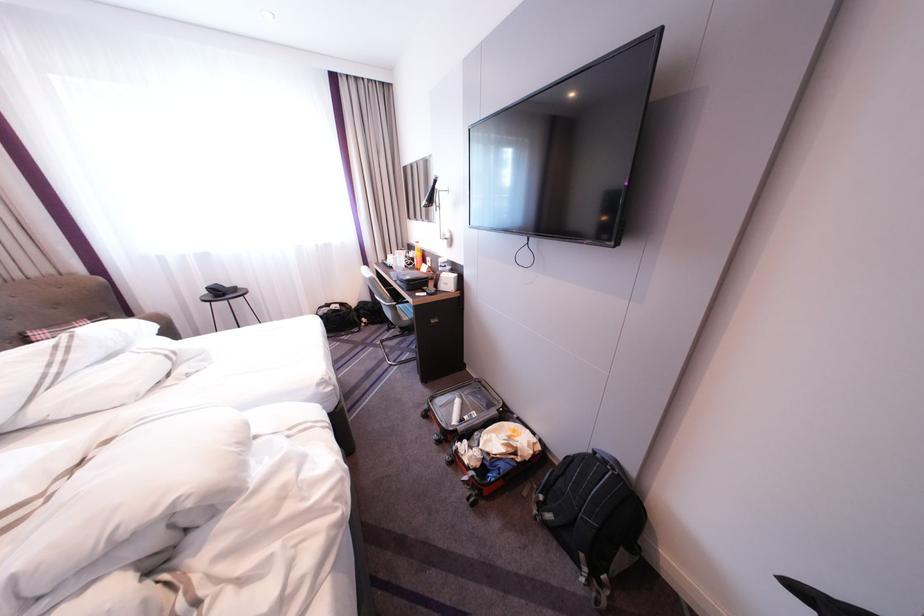
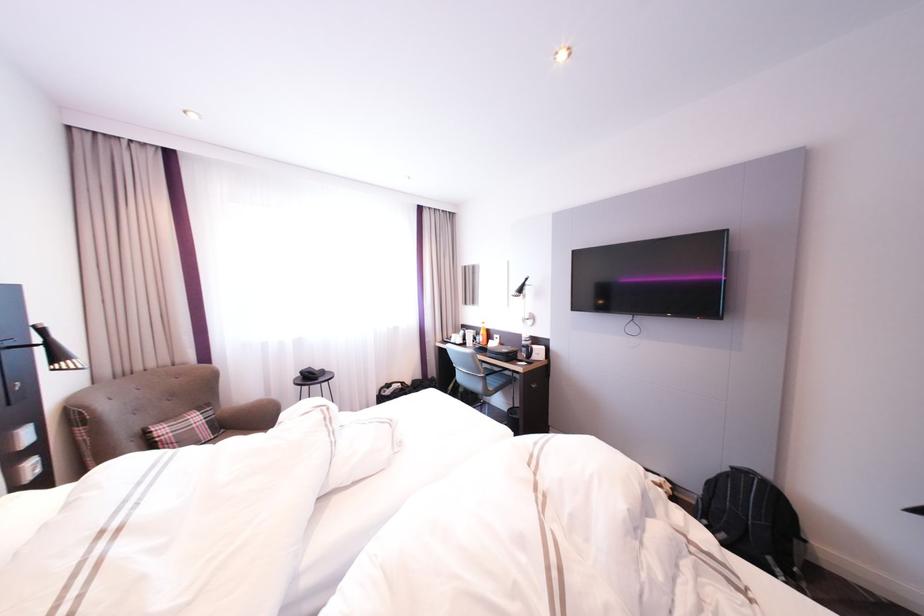
In the second image, find the point that corresponds to [396,301] in the first image.

(492, 373)